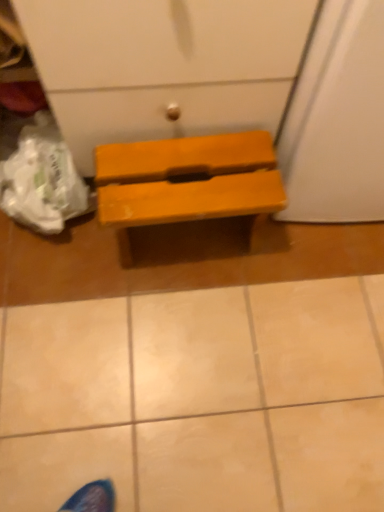
Question: From the image's perspective, is wooden bench at center under matte yellow bench at center?

Choices:
 (A) yes
 (B) no

Answer: (A)

Question: Considering the relative sizes of wooden bench at center and matte yellow bench at center in the image provided, is wooden bench at center shorter than matte yellow bench at center?

Choices:
 (A) no
 (B) yes

Answer: (B)

Question: Does wooden bench at center have a smaller size compared to matte yellow bench at center?

Choices:
 (A) no
 (B) yes

Answer: (A)

Question: Would you say matte yellow bench at center is part of wooden bench at center's contents?

Choices:
 (A) yes
 (B) no

Answer: (B)

Question: From a real-world perspective, is wooden bench at center positioned over matte yellow bench at center based on gravity?

Choices:
 (A) no
 (B) yes

Answer: (A)

Question: Can you confirm if wooden bench at center is positioned to the right of matte yellow bench at center?

Choices:
 (A) yes
 (B) no

Answer: (A)

Question: Could you tell me if matte yellow bench at center is facing wooden bench at center?

Choices:
 (A) no
 (B) yes

Answer: (A)

Question: Is matte yellow bench at center shorter than wooden bench at center?

Choices:
 (A) yes
 (B) no

Answer: (B)

Question: Is matte yellow bench at center in front of wooden bench at center?

Choices:
 (A) yes
 (B) no

Answer: (B)

Question: Does matte yellow bench at center come behind wooden bench at center?

Choices:
 (A) yes
 (B) no

Answer: (A)

Question: Are matte yellow bench at center and wooden bench at center far apart?

Choices:
 (A) no
 (B) yes

Answer: (A)

Question: Can you confirm if matte yellow bench at center is smaller than wooden bench at center?

Choices:
 (A) yes
 (B) no

Answer: (A)

Question: Is wooden bench at center wider or thinner than matte yellow bench at center?

Choices:
 (A) thin
 (B) wide

Answer: (B)